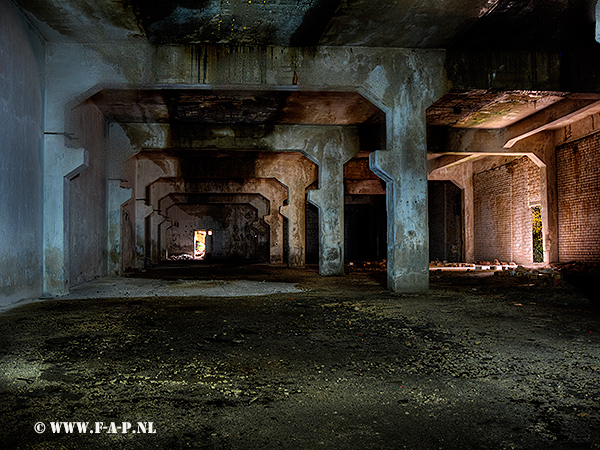
The height and width of the screenshot is (450, 600). I want to click on beam, so click(x=418, y=202), click(x=327, y=225), click(x=300, y=239), click(x=276, y=240), click(x=259, y=237), click(x=63, y=168), click(x=113, y=196), click(x=143, y=212), click(x=156, y=217), click(x=161, y=225).